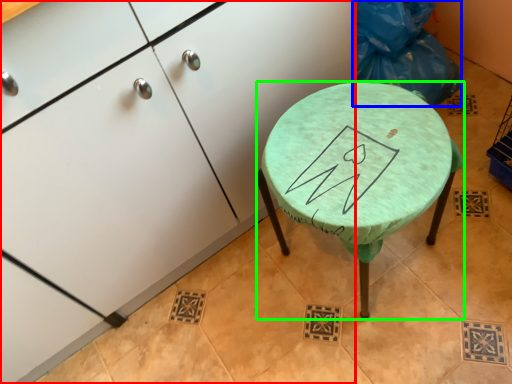
Question: Which is farther away from cabinetry (highlighted by a red box)? garbage (highlighted by a blue box) or stool (highlighted by a green box)?

Choices:
 (A) garbage
 (B) stool

Answer: (A)